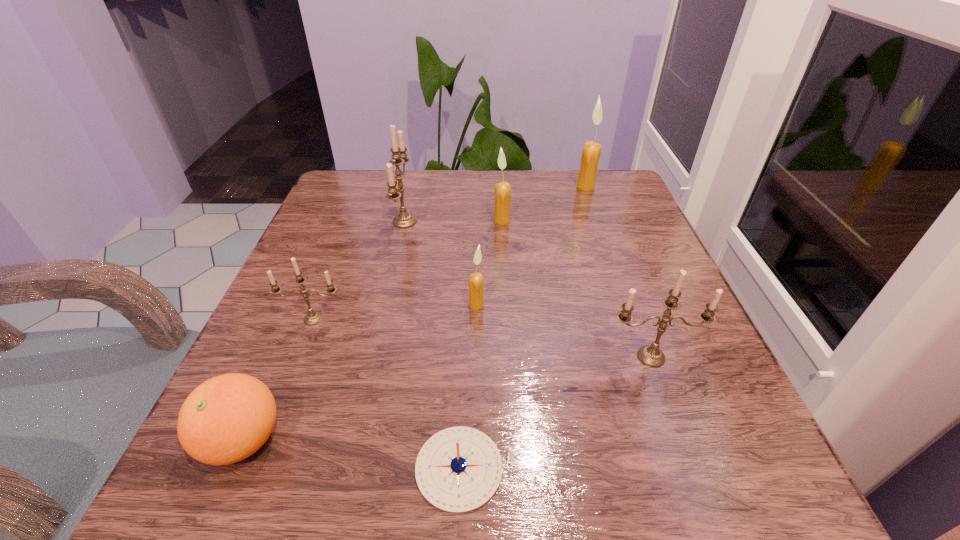
Locate an element on the screen. vacant space that's between the nearest cream candle and the rightmost cream candle is located at coordinates (531, 246).

You are a GUI agent. You are given a task and a screenshot of the screen. Output one action in this format:
    pyautogui.click(x=<x>, y=<y>)
    Task: Click on the free point between the biggest cream candle and the rightmost metallic candle
    The height and width of the screenshot is (540, 960).
    Given the screenshot: What is the action you would take?
    pyautogui.click(x=618, y=272)

What are the coordinates of `free space that is in between the leftmost cream candle and the second metallic candle from left to right` in the screenshot? It's located at 441,264.

Locate an element on the screen. free space between the shortest object and the second cream candle from left to right is located at coordinates (480, 344).

Find the location of a particular element. Image resolution: width=960 pixels, height=540 pixels. vacant space that's between the nearest cream candle and the fourth candle from left to right is located at coordinates (489, 262).

Identify the location of free spot between the third object from left to right and the second biggest metallic candle. The height and width of the screenshot is (540, 960). (528, 289).

Point out which object is positioned as the seventh nearest to the shortest object. Please provide its 2D coordinates. Your answer should be formatted as a tuple, i.e. [(x, y)], where the tuple contains the x and y coordinates of a point satisfying the conditions above.

[(591, 152)]

Identify which object is the third closest to the second smallest cream candle. Please provide its 2D coordinates. Your answer should be formatted as a tuple, i.e. [(x, y)], where the tuple contains the x and y coordinates of a point satisfying the conditions above.

[(476, 302)]

Locate an element on the screen. the fourth closest candle to the leftmost candle is located at coordinates (650, 355).

Image resolution: width=960 pixels, height=540 pixels. Identify the location of candle that is the second closest to the second biggest cream candle. (591, 152).